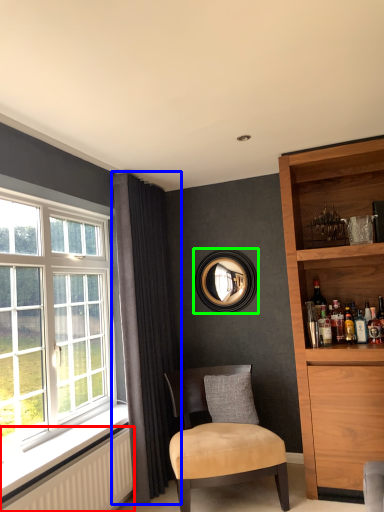
Question: Which object is positioned closest to radiator (highlighted by a red box)? Select from curtain (highlighted by a blue box) and picture frame (highlighted by a green box).

Choices:
 (A) curtain
 (B) picture frame

Answer: (A)